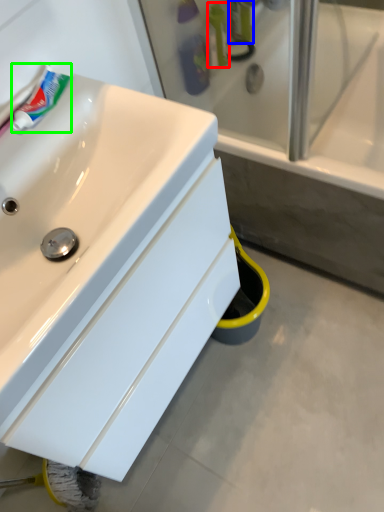
Question: Which is nearer to the mouthwash (highlighted by a red box)? toiletry (highlighted by a blue box) or toothpaste (highlighted by a green box).

Choices:
 (A) toiletry
 (B) toothpaste

Answer: (A)